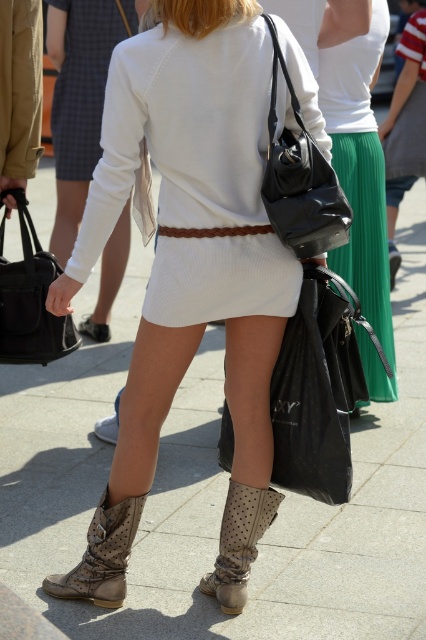
Which of these two, black matte bag at center or matte black handbag at left, stands taller?

black matte bag at center is taller.

Is black matte bag at center shorter than matte black handbag at left?

No, black matte bag at center is not shorter than matte black handbag at left.

Is point (324, 308) behind point (43, 355)?

No, (324, 308) is in front of (43, 355).

Locate an element on the screen. Image resolution: width=426 pixels, height=640 pixels. black matte bag at center is located at coordinates (316, 388).

Does leather boots at lower center appear on the left side of white knit dress at center?

In fact, leather boots at lower center is to the right of white knit dress at center.

Who is shorter, leather boots at lower center or white knit dress at center?

white knit dress at center is shorter.

Between point (249, 486) and point (101, 90), which one is positioned in front?

Point (249, 486) is more forward.

You are a GUI agent. You are given a task and a screenshot of the screen. Output one action in this format:
    pyautogui.click(x=<x>, y=<y>)
    Task: Click on the leather boots at lower center
    The width and height of the screenshot is (426, 640).
    Given the screenshot: What is the action you would take?
    pyautogui.click(x=189, y=272)

Does matte black handbag at left appear on the right side of leather textured cowboy boot at lower center?

No, matte black handbag at left is not to the right of leather textured cowboy boot at lower center.

Which is in front, point (19, 364) or point (229, 541)?

Point (229, 541) is more forward.

Does point (23, 236) come closer to viewer compared to point (229, 612)?

That is False.

The height and width of the screenshot is (640, 426). In order to click on matte black handbag at left in this screenshot , I will do `click(29, 298)`.